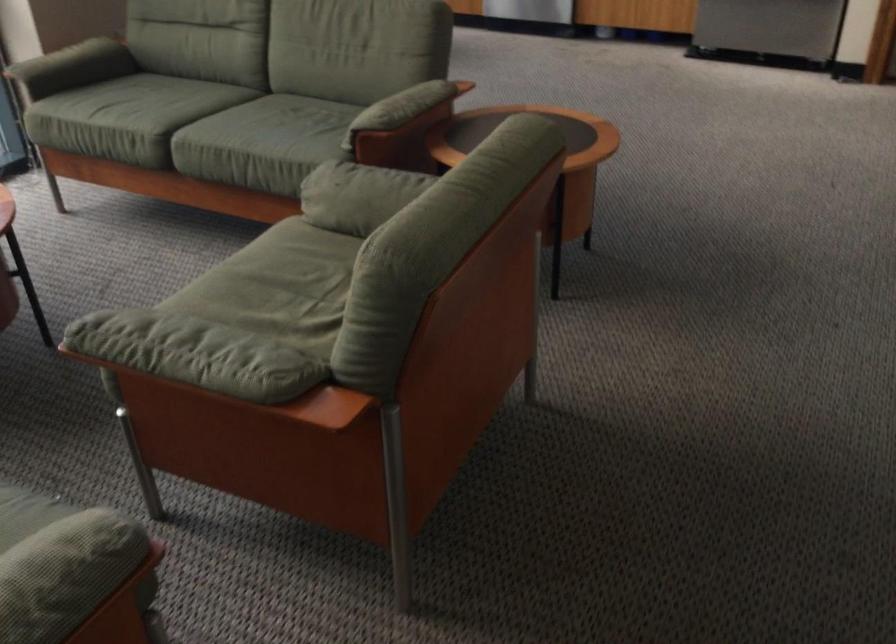
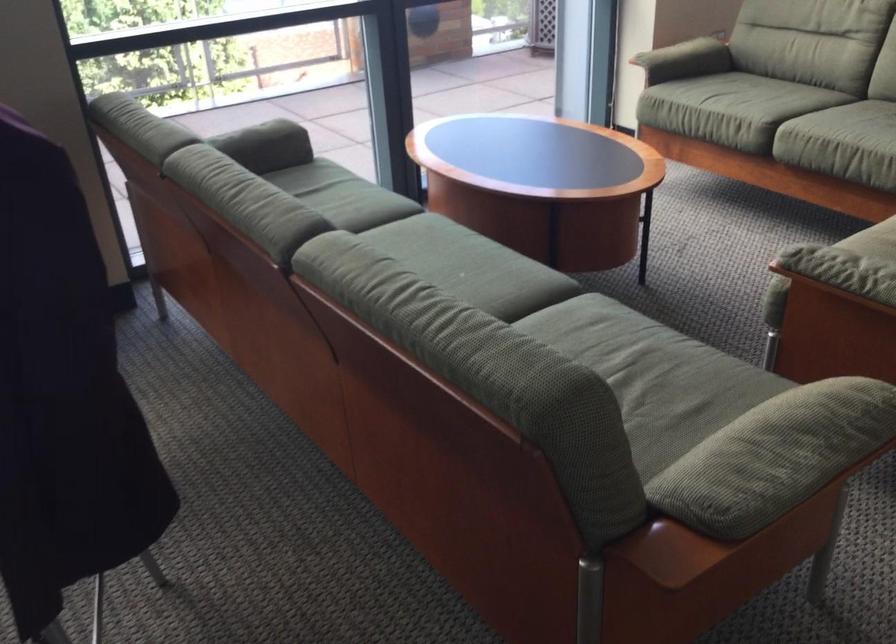
Where in the second image is the point corresponding to [134,337] from the first image?

(834, 263)